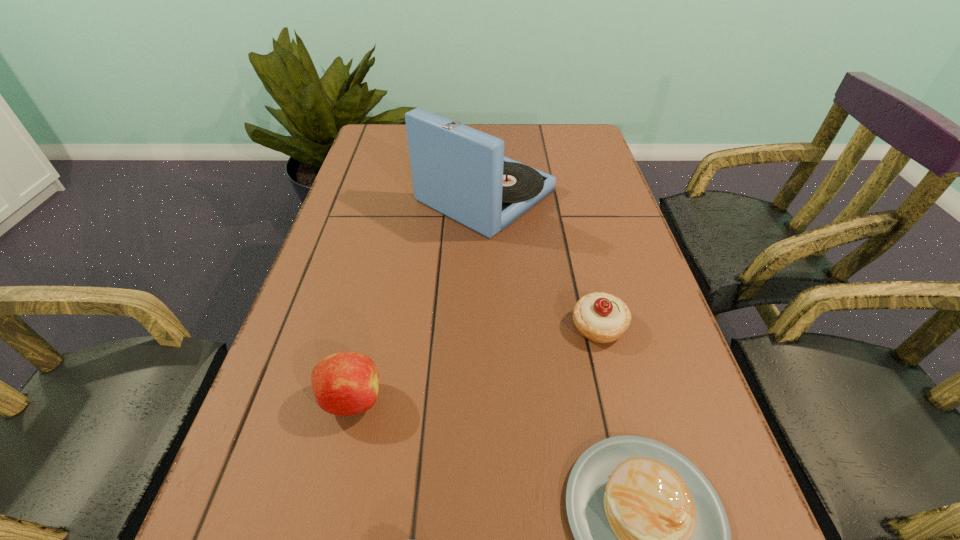
This screenshot has height=540, width=960. What are the coordinates of `object that can be found as the second closest to the third tallest object` in the screenshot? It's located at (460, 172).

Where is `free space that satisfies the following two spatial constraints: 1. on the back side of the second tallest object; 2. on the right side of the phonograph record`? The image size is (960, 540). free space that satisfies the following two spatial constraints: 1. on the back side of the second tallest object; 2. on the right side of the phonograph record is located at coordinates (398, 196).